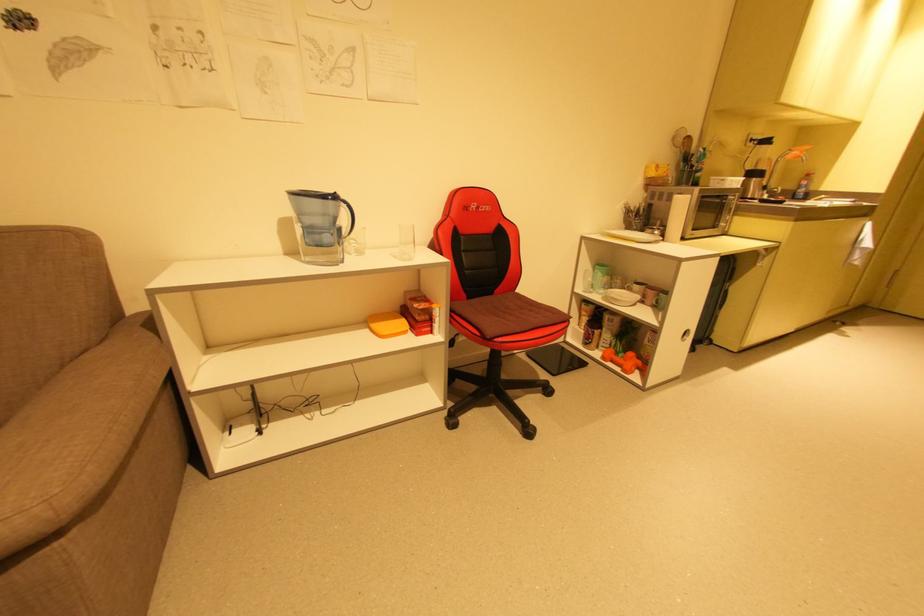
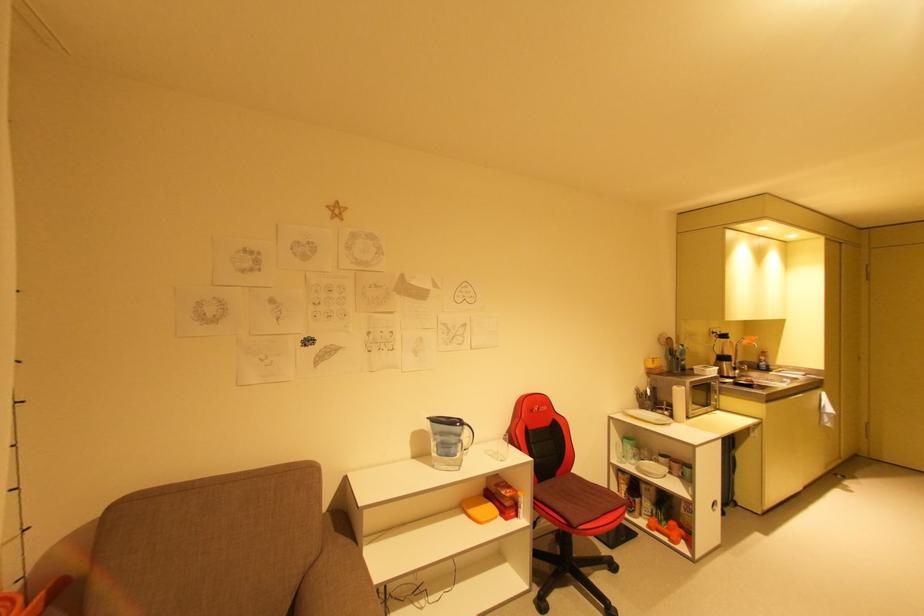
In the second image, find the point that corresponds to the point at 687,339 in the first image.

(718, 511)